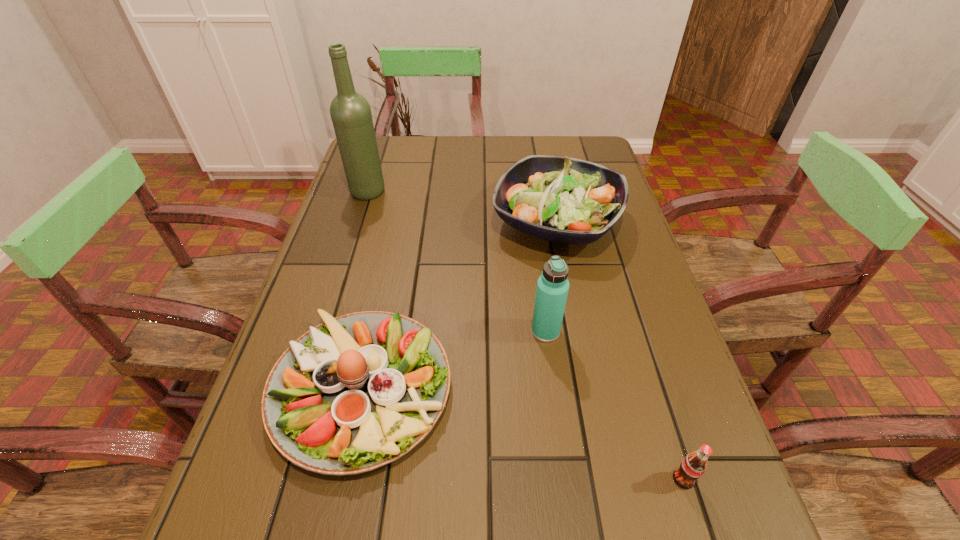
You are a GUI agent. You are given a task and a screenshot of the screen. Output one action in this format:
    pyautogui.click(x=<x>, y=<y>)
    Task: Click on the blank area located 0.150m on the left of the soda
    
    Given the screenshot: What is the action you would take?
    pyautogui.click(x=578, y=479)

Find the location of a particular element. This screenshot has height=540, width=960. vacant space situated 0.060m on the back of the shorter salad plate is located at coordinates 381,299.

In order to click on wine bottle located in the left edge section of the desktop in this screenshot , I will do `click(350, 112)`.

You are a GUI agent. You are given a task and a screenshot of the screen. Output one action in this format:
    pyautogui.click(x=<x>, y=<y>)
    Task: Click on the salad plate at the left edge
    The height and width of the screenshot is (540, 960).
    Given the screenshot: What is the action you would take?
    pyautogui.click(x=356, y=392)

Image resolution: width=960 pixels, height=540 pixels. Identify the location of salad plate that is at the right edge. (566, 200).

Find the location of a particular element. The image size is (960, 540). soda that is at the right edge is located at coordinates (693, 466).

This screenshot has height=540, width=960. In the image, there is a desktop. Identify the location of vacant area at the far edge. (488, 135).

This screenshot has width=960, height=540. Find the location of `free region at the left edge`. free region at the left edge is located at coordinates (383, 196).

In the image, there is a desktop. Identify the location of free space at the right edge. Image resolution: width=960 pixels, height=540 pixels. (639, 527).

In the image, there is a desktop. Identify the location of vacant space at the far left corner. (396, 136).